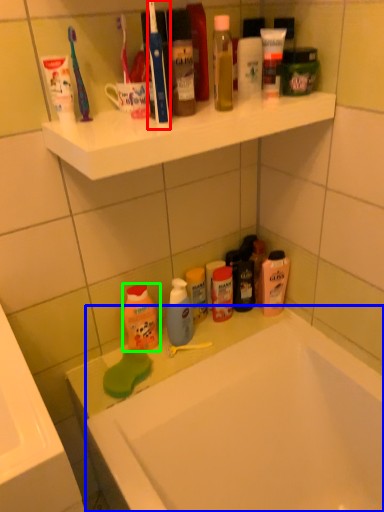
Question: Considering the real-world distances, which object is farthest from toothbrush (highlighted by a red box)? bathtub (highlighted by a blue box) or cleaning product (highlighted by a green box)?

Choices:
 (A) bathtub
 (B) cleaning product

Answer: (A)